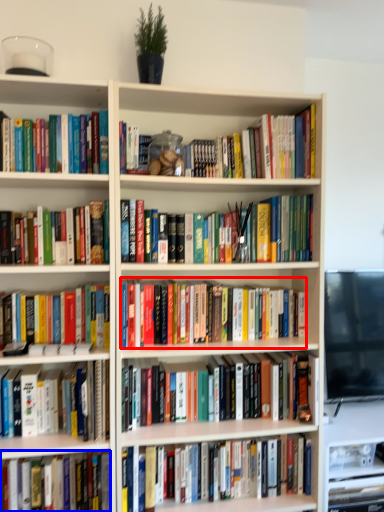
Question: Among these objects, which one is farthest to the camera, book (highlighted by a red box) or book (highlighted by a blue box)?

Choices:
 (A) book
 (B) book

Answer: (A)